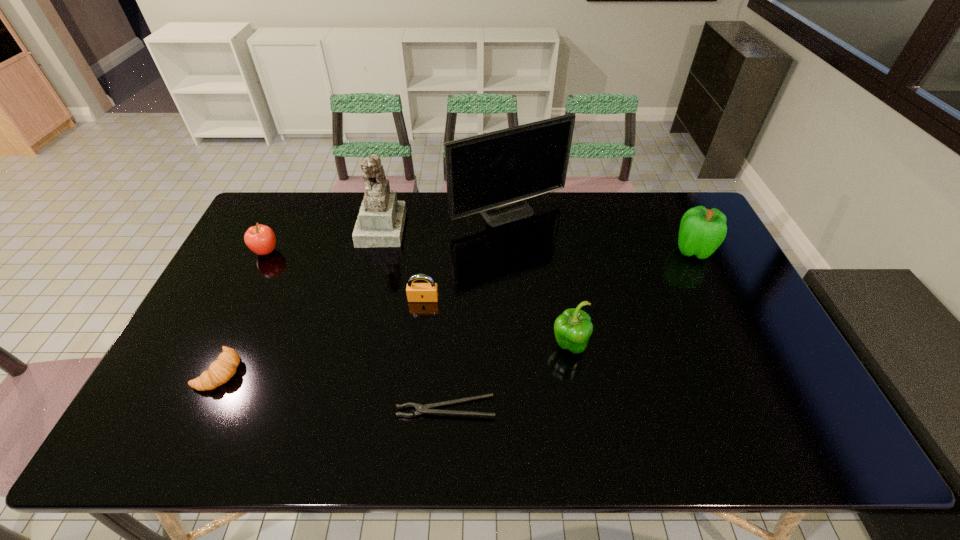
Find the location of a particular element. object identified as the second closest to the apple is located at coordinates click(x=220, y=371).

This screenshot has height=540, width=960. I want to click on vacant area in the image that satisfies the following two spatial constraints: 1. on the front-facing side of the left bell pepper; 2. on the left side of the computer monitor, so click(517, 346).

Find the location of a particular element. This screenshot has height=540, width=960. vacant region that satisfies the following two spatial constraints: 1. on the front-facing side of the figurine; 2. on the front side of the apple is located at coordinates (375, 252).

Locate an element on the screen. vacant space that satisfies the following two spatial constraints: 1. to unlock the nearer bell pepper from the front; 2. on the left side of the padlock is located at coordinates (418, 346).

Find the location of a particular element. vacant region that satisfies the following two spatial constraints: 1. on the front-facing side of the figurine; 2. on the right side of the left bell pepper is located at coordinates (352, 346).